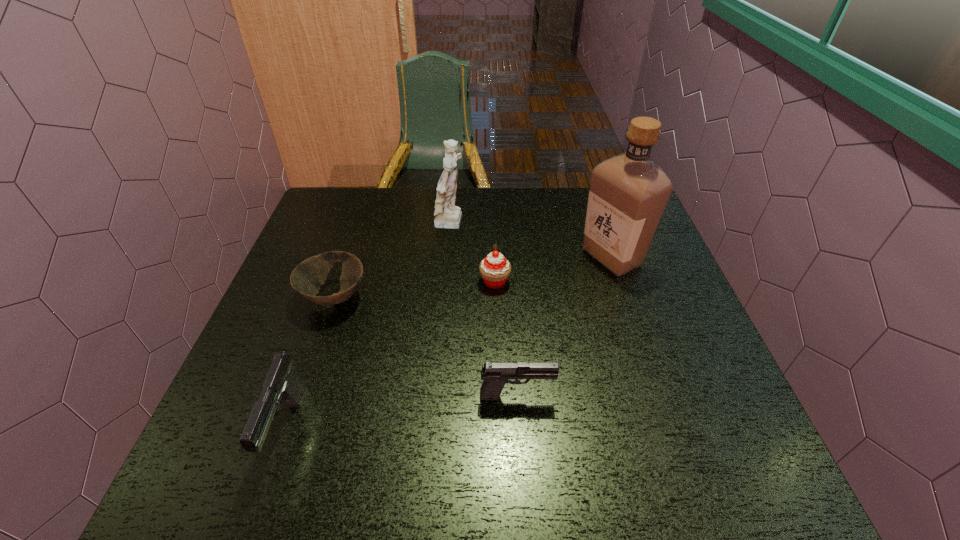
At what (x,y) coordinates should I click in order to perform the action: click on vacant space situated on the front of the cupcake. Please return your answer as a coordinate pair (x, y). Image resolution: width=960 pixels, height=540 pixels. Looking at the image, I should click on (497, 363).

At what (x,y) coordinates should I click in order to perform the action: click on vacant point located 0.300m on the front-facing side of the rightmost object. Please return your answer as a coordinate pair (x, y). Looking at the image, I should click on (472, 257).

Identify the location of free space located on the front-facing side of the rightmost object. Image resolution: width=960 pixels, height=540 pixels. (454, 257).

This screenshot has width=960, height=540. What are the coordinates of `free space located on the front-facing side of the rightmost object` in the screenshot? It's located at (461, 257).

Where is `free space located on the front-facing side of the second tallest object`? This screenshot has height=540, width=960. free space located on the front-facing side of the second tallest object is located at coordinates (494, 225).

I want to click on vacant space located 0.340m on the back of the bowl, so click(x=366, y=204).

At what (x,y) coordinates should I click in order to perform the action: click on object that is positioned at the far edge. Please return your answer as a coordinate pair (x, y). This screenshot has width=960, height=540. Looking at the image, I should click on (447, 215).

Identify the location of pistol located in the left edge section of the desktop. Image resolution: width=960 pixels, height=540 pixels. (281, 384).

This screenshot has height=540, width=960. I want to click on bowl positioned at the left edge, so click(x=306, y=279).

Locate an element on the screen. object that is at the right edge is located at coordinates (628, 194).